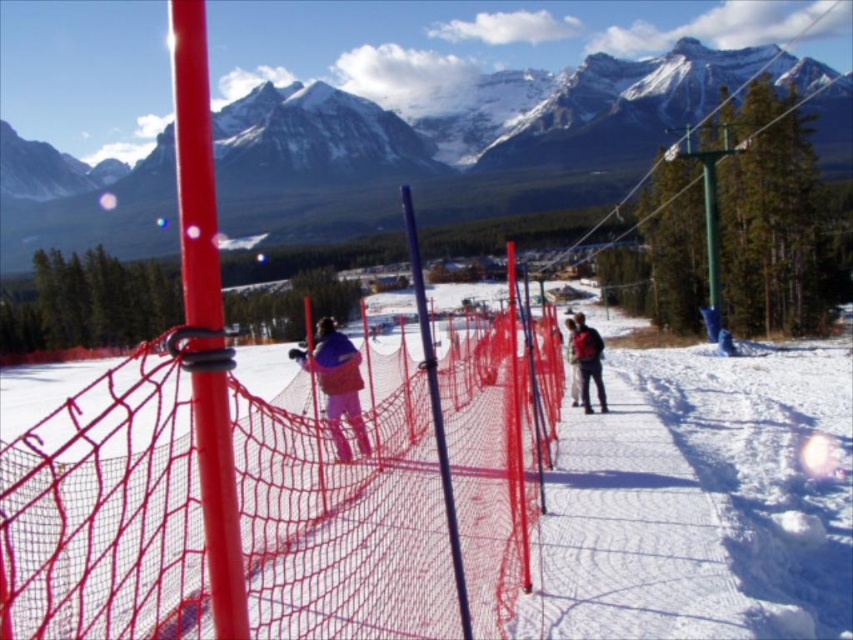
You are a photographer trying to capture a person wearing both the matte black jacket at center and white snow pants at center in a single shot. Based on their sizes, which clothing item will appear larger in the photo?

The white snow pants at center will appear larger in the photo because the matte black jacket at center has a smaller size compared to white snow pants at center.

You are a photographer trying to capture a winter scene with the matte blue jacket at center and white snow pants at center. Which object should you zoom in on if you want to focus on the narrower one?

The matte blue jacket at center has a lesser width compared to the white snow pants at center, so you should zoom in on the matte blue jacket at center to focus on the narrower one.